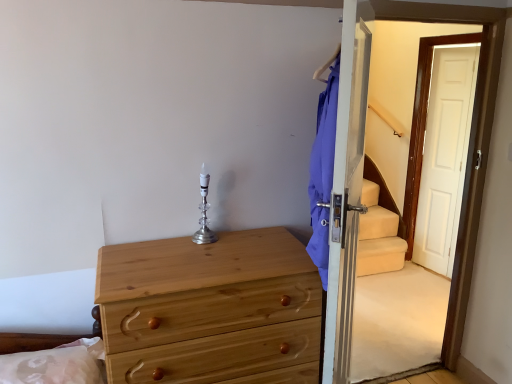
I want to click on vacant space in front of silver/crystal candle holder at center, so click(194, 253).